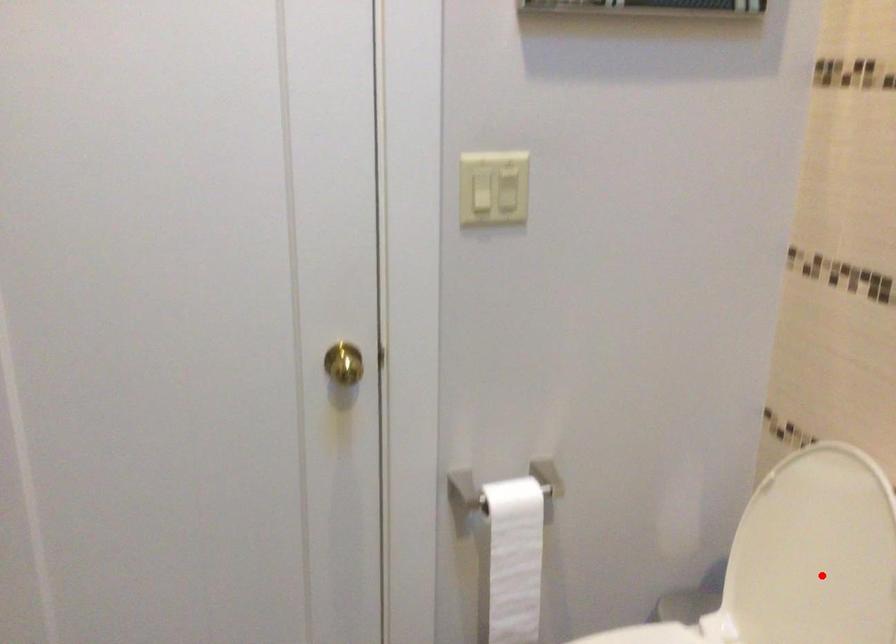
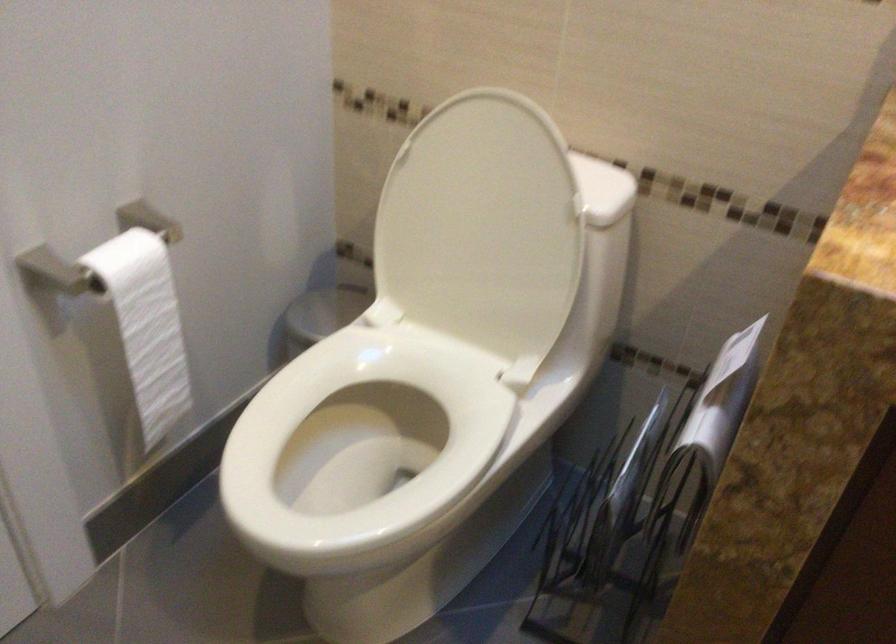
Question: I am providing you with two images of the same scene from different viewpoints. A red point is marked on the first image. Can you still see the location of the red point in image 2?

Choices:
 (A) Yes
 (B) No

Answer: (A)